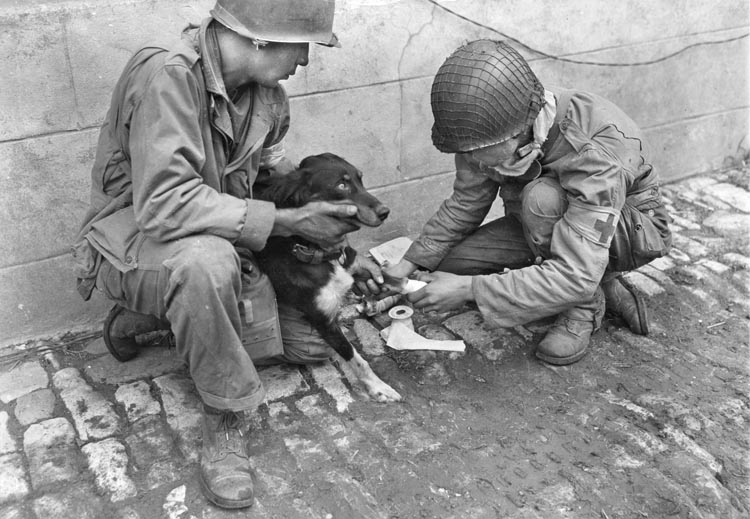
Locate an element on the screen. The height and width of the screenshot is (519, 750). crack in wall is located at coordinates (418, 26).